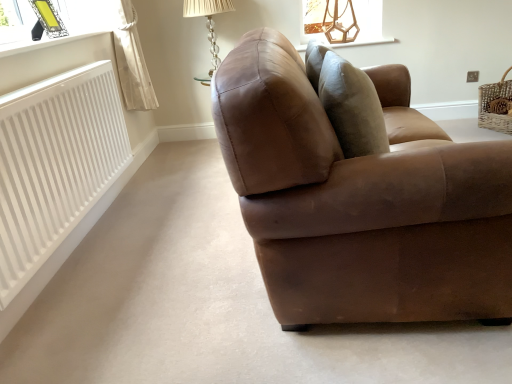
Question: From a real-world perspective, is translucent glass table lamp at upper center located beneath brown leather couch at center?

Choices:
 (A) yes
 (B) no

Answer: (B)

Question: Does translucent glass table lamp at upper center have a greater width compared to brown leather couch at center?

Choices:
 (A) yes
 (B) no

Answer: (B)

Question: Considering the relative sizes of translucent glass table lamp at upper center and brown leather couch at center in the image provided, is translucent glass table lamp at upper center bigger than brown leather couch at center?

Choices:
 (A) yes
 (B) no

Answer: (B)

Question: From the image's perspective, is translucent glass table lamp at upper center located beneath brown leather couch at center?

Choices:
 (A) no
 (B) yes

Answer: (A)

Question: Does translucent glass table lamp at upper center lie in front of brown leather couch at center?

Choices:
 (A) yes
 (B) no

Answer: (B)

Question: Is translucent glass table lamp at upper center with brown leather couch at center?

Choices:
 (A) no
 (B) yes

Answer: (A)

Question: Can you confirm if wooden at upper center is thinner than translucent glass table lamp at upper center?

Choices:
 (A) no
 (B) yes

Answer: (B)

Question: Is wooden at upper center smaller than translucent glass table lamp at upper center?

Choices:
 (A) yes
 (B) no

Answer: (A)

Question: Is the surface of wooden at upper center in direct contact with translucent glass table lamp at upper center?

Choices:
 (A) yes
 (B) no

Answer: (B)

Question: Is wooden at upper center shorter than translucent glass table lamp at upper center?

Choices:
 (A) yes
 (B) no

Answer: (A)

Question: From the image's perspective, does wooden at upper center appear higher than translucent glass table lamp at upper center?

Choices:
 (A) yes
 (B) no

Answer: (A)

Question: Does wooden at upper center turn towards translucent glass table lamp at upper center?

Choices:
 (A) yes
 (B) no

Answer: (B)

Question: Would you say translucent glass table lamp at upper center contains white smooth radiator at left?

Choices:
 (A) no
 (B) yes

Answer: (A)